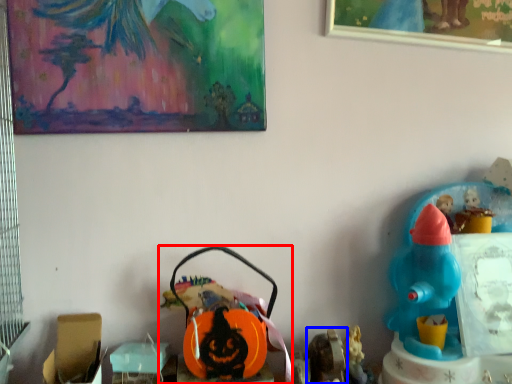
Question: Which point is further to the camera, toy (highlighted by a red box) or toy (highlighted by a blue box)?

Choices:
 (A) toy
 (B) toy

Answer: (A)